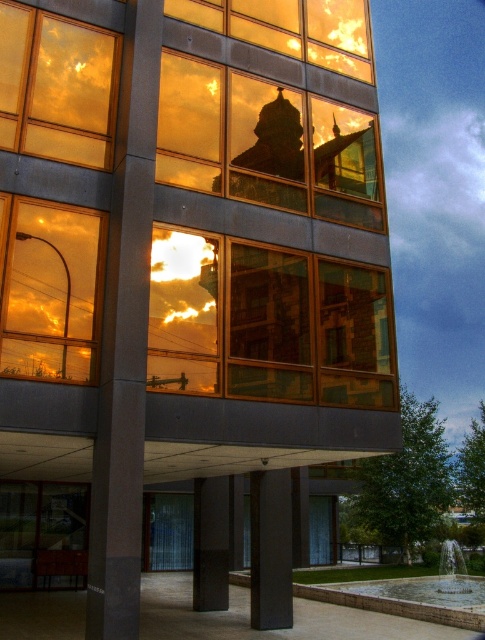
You are standing in front of the modern building and want to locate two specific points marked in the image. Which of the two points, point [470,612] or point [176,499], is closer to you?

Point [470,612] is closer to the viewer than point [176,499].

You are standing in front of the modern building and want to enter through the transparent glass door at lower center. There is a smooth concrete fountain at lower center in your way. Can you walk around the fountain to reach the door?

The smooth concrete fountain at lower center is taller than the transparent glass door at lower center, so you can walk around it since it is not blocking the entrance completely.

What are the coordinates of the matte glass window at upper left?

The coordinates of the matte glass window at upper left are (57, 86).